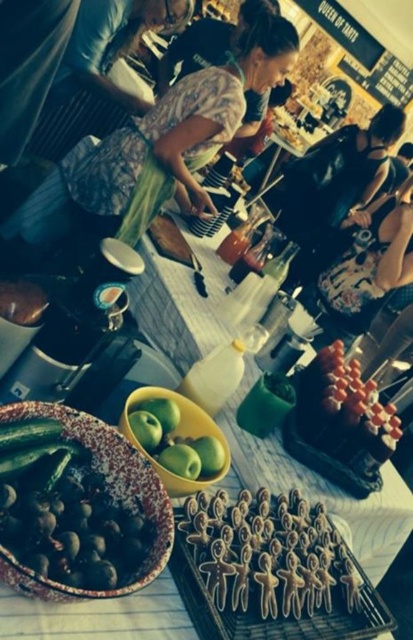
Question: Among these objects, which one is farthest from the camera?

Choices:
 (A) brown sugar cookies at center
 (B) camouflage fabric apron at center
 (C) smooth orange skewers at center
 (D) green matte apples at center

Answer: (B)

Question: Considering the relative positions of speckled ceramic bowl of olives at center-left and green matte apples at center in the image provided, where is speckled ceramic bowl of olives at center-left located with respect to green matte apples at center?

Choices:
 (A) below
 (B) above

Answer: (A)

Question: Can you confirm if camouflage fabric apron at center is positioned to the right of green matte apples at center?

Choices:
 (A) no
 (B) yes

Answer: (A)

Question: Can you confirm if camouflage fabric apron at center is smaller than smooth orange skewers at center?

Choices:
 (A) yes
 (B) no

Answer: (B)

Question: Which is farther from the smooth orange skewers at center?

Choices:
 (A) green matte apples at center
 (B) speckled ceramic bowl of olives at center-left
 (C) brown sugar cookies at center

Answer: (B)

Question: Which point appears farthest from the camera in this image?

Choices:
 (A) (268, 529)
 (B) (358, 472)
 (C) (101, 202)

Answer: (C)